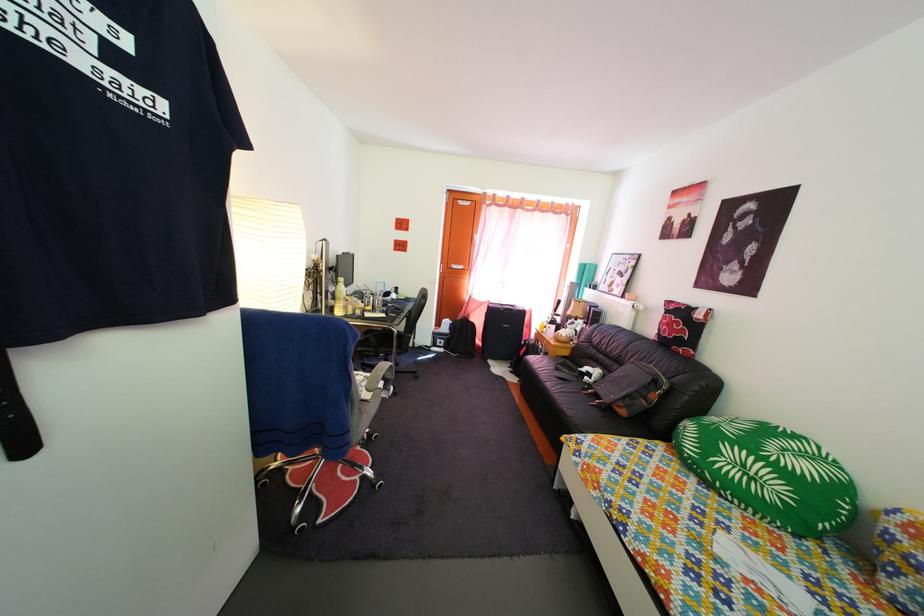
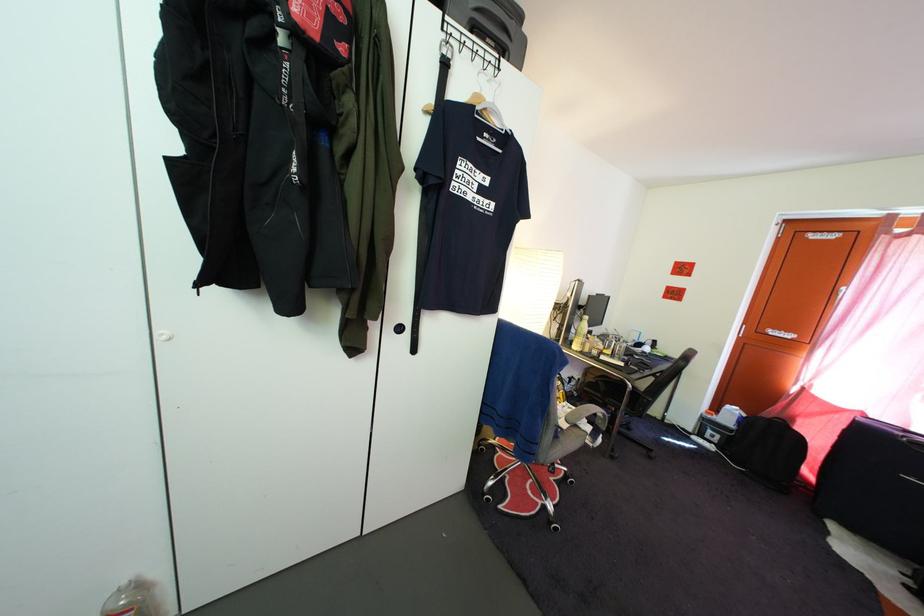
Where in the second image is the point corresponding to (365,410) from the first image?

(562, 432)